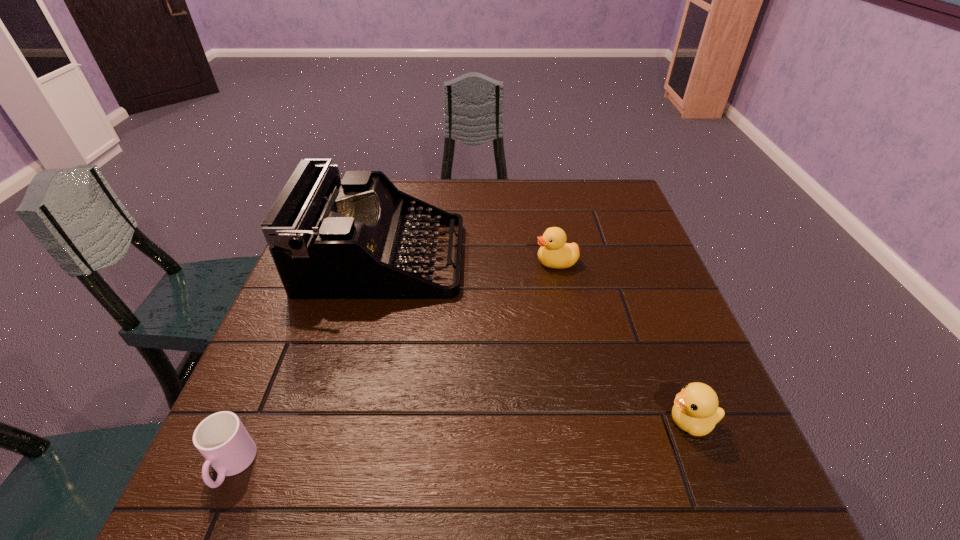
Where is `free space at the left edge of the desktop`? free space at the left edge of the desktop is located at coordinates (294, 374).

You are a GUI agent. You are given a task and a screenshot of the screen. Output one action in this format:
    pyautogui.click(x=<x>, y=<y>)
    Task: Click on the vacant position at the right edge of the desktop
    The height and width of the screenshot is (540, 960).
    Given the screenshot: What is the action you would take?
    pyautogui.click(x=700, y=448)

You are a GUI agent. You are given a task and a screenshot of the screen. Output one action in this format:
    pyautogui.click(x=<x>, y=<y>)
    Task: Click on the vacant area at the near right corner of the desktop
    This screenshot has height=540, width=960.
    Given the screenshot: What is the action you would take?
    click(739, 485)

Locate an element on the screen. free space between the typewriter and the cup is located at coordinates (307, 362).

What are the coordinates of `free spot between the right duck and the cup` in the screenshot? It's located at (462, 444).

Image resolution: width=960 pixels, height=540 pixels. Identify the location of free space that is in between the left duck and the nearer duck. (623, 342).

Where is `empty location between the cup and the tallest object`? The image size is (960, 540). empty location between the cup and the tallest object is located at coordinates (307, 362).

The image size is (960, 540). Identify the location of free point between the cup and the tallest object. (307, 362).

Locate an element on the screen. The image size is (960, 540). unoccupied position between the typewriter and the cup is located at coordinates (307, 362).

At what (x,y) coordinates should I click in order to perform the action: click on vacant area that lies between the rightmost object and the cup. Please return your answer as a coordinate pair (x, y). The height and width of the screenshot is (540, 960). Looking at the image, I should click on (462, 444).